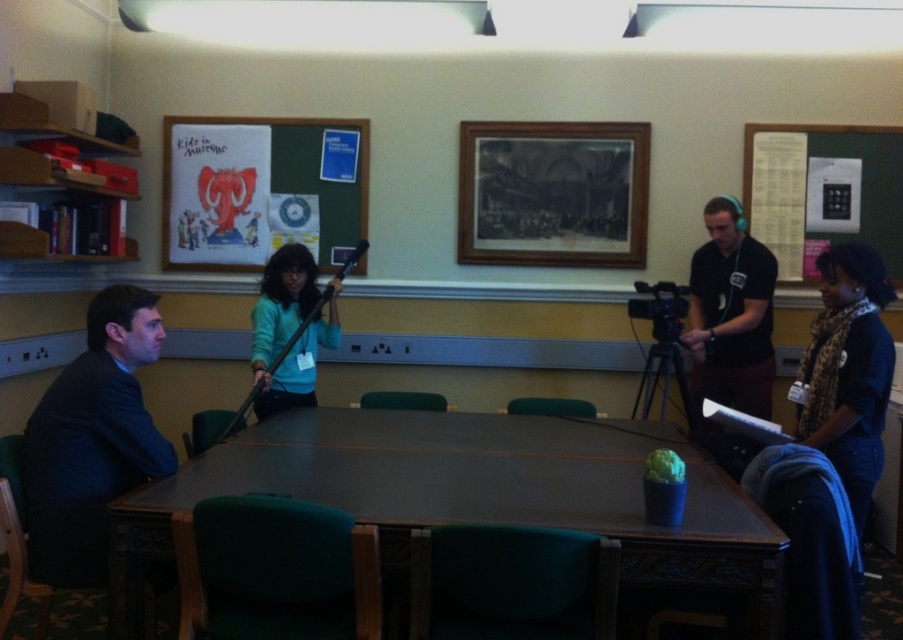
Which is behind, point (36, 406) or point (770, 147)?

The point (770, 147) is behind.

Can you confirm if dark blue suit at left is positioned to the right of white paperboard at upper right?

No, dark blue suit at left is not to the right of white paperboard at upper right.

Is point (95, 324) positioned in front of point (779, 182)?

That is True.

Identify the location of dark blue suit at left. This screenshot has height=640, width=903. coord(92,440).

What do you see at coordinates (262, 189) in the screenshot? Image resolution: width=903 pixels, height=640 pixels. I see `matte paper poster at upper center` at bounding box center [262, 189].

Is matte paper poster at upper center bigger than leopard print scarf at right?

No.

At what (x,y) coordinates should I click in order to perform the action: click on matte paper poster at upper center. Please return your answer as a coordinate pair (x, y). Image resolution: width=903 pixels, height=640 pixels. Looking at the image, I should click on (262, 189).

The height and width of the screenshot is (640, 903). Identify the location of matte paper poster at upper center. (262, 189).

Who is lower down, matte paper poster at upper center or black matte headphones at upper right?

black matte headphones at upper right is below.

Where is `matte paper poster at upper center`? This screenshot has width=903, height=640. matte paper poster at upper center is located at coordinates (262, 189).